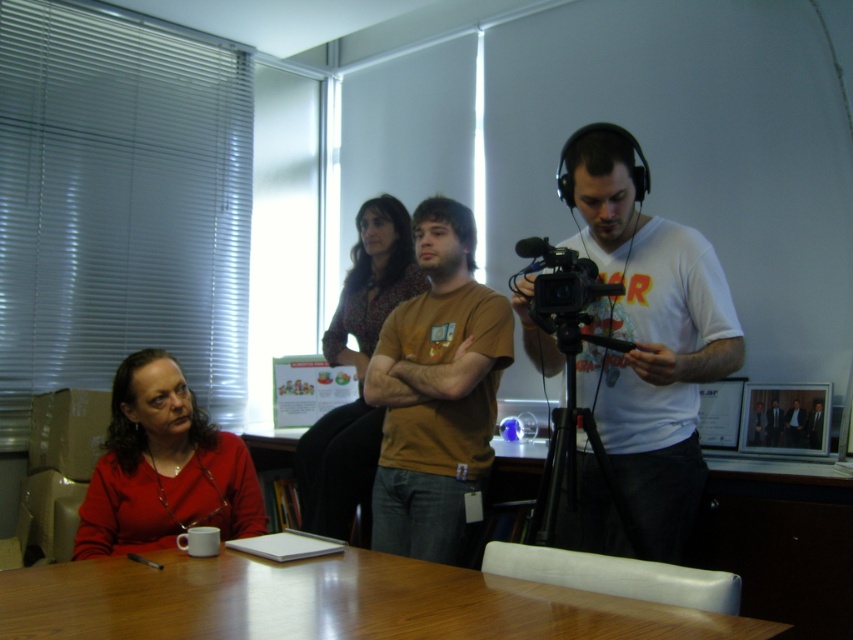
Does point (202, 449) lie behind point (384, 291)?

No, (202, 449) is closer to viewer.

Does matte red shirt at lower left appear under matte brown blouse at center?

Correct, matte red shirt at lower left is located below matte brown blouse at center.

Describe the element at coordinates (163, 467) in the screenshot. This screenshot has width=853, height=640. I see `matte red shirt at lower left` at that location.

Where is `matte red shirt at lower left`? matte red shirt at lower left is located at coordinates (163, 467).

Is wooden table at lower center shorter than black plastic video camera at center?

Correct, wooden table at lower center is not as tall as black plastic video camera at center.

Based on the photo, does wooden table at lower center appear on the right side of black plastic video camera at center?

In fact, wooden table at lower center is to the left of black plastic video camera at center.

What do you see at coordinates (328, 602) in the screenshot?
I see `wooden table at lower center` at bounding box center [328, 602].

Where is `wooden table at lower center`? The width and height of the screenshot is (853, 640). wooden table at lower center is located at coordinates (328, 602).

Which is above, wooden table at lower center or matte brown blouse at center?

Positioned higher is matte brown blouse at center.

Can you confirm if wooden table at lower center is smaller than matte brown blouse at center?

Yes, wooden table at lower center is smaller than matte brown blouse at center.

Is point (335, 593) positioned in front of point (397, 220)?

Yes.

Where is `wooden table at lower center`? This screenshot has width=853, height=640. wooden table at lower center is located at coordinates (328, 602).